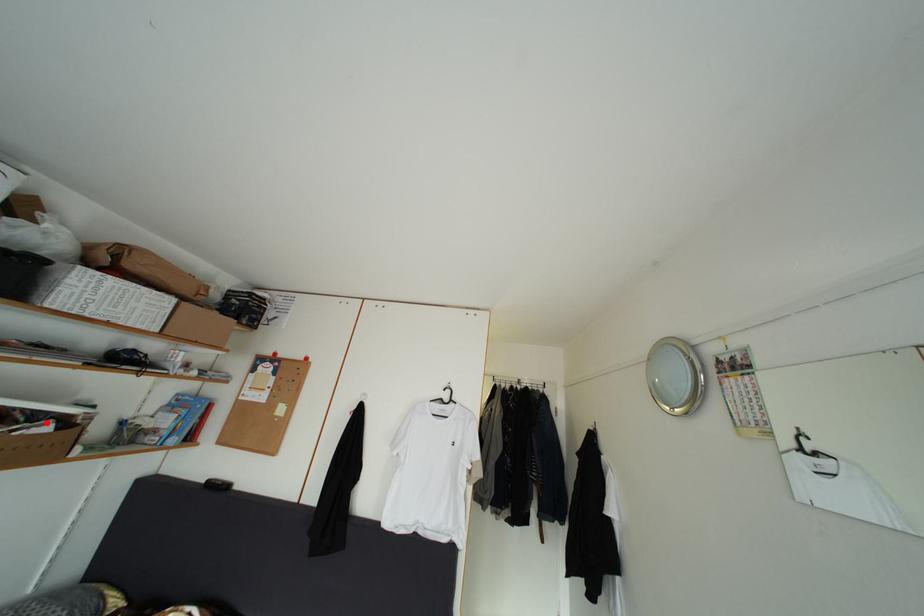
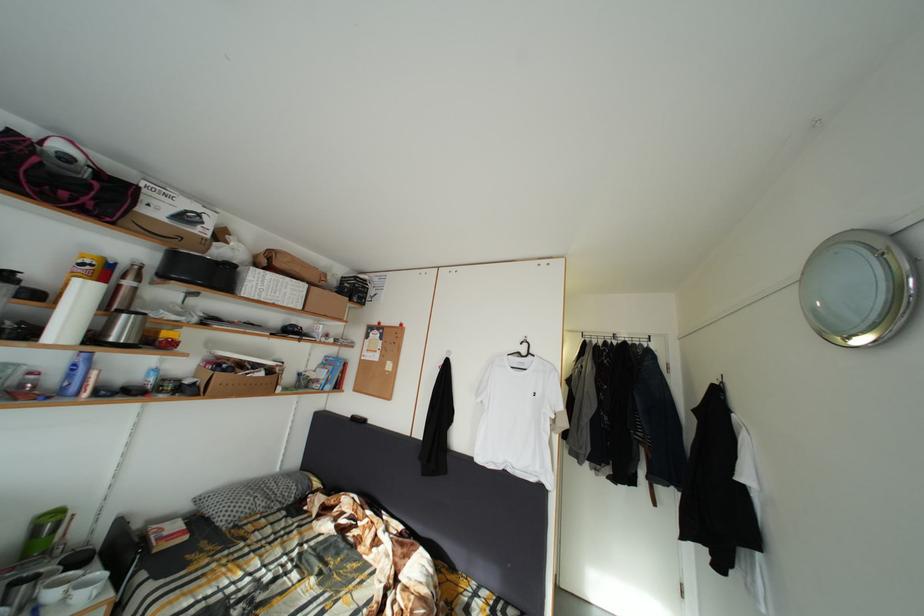
Question: I am providing you with two images of the same scene from different viewpoints. A red point is shown in image1. For the corresponding object point in image2, is it positioned nearer or farther from the camera?

Choices:
 (A) Nearer
 (B) Farther

Answer: (B)